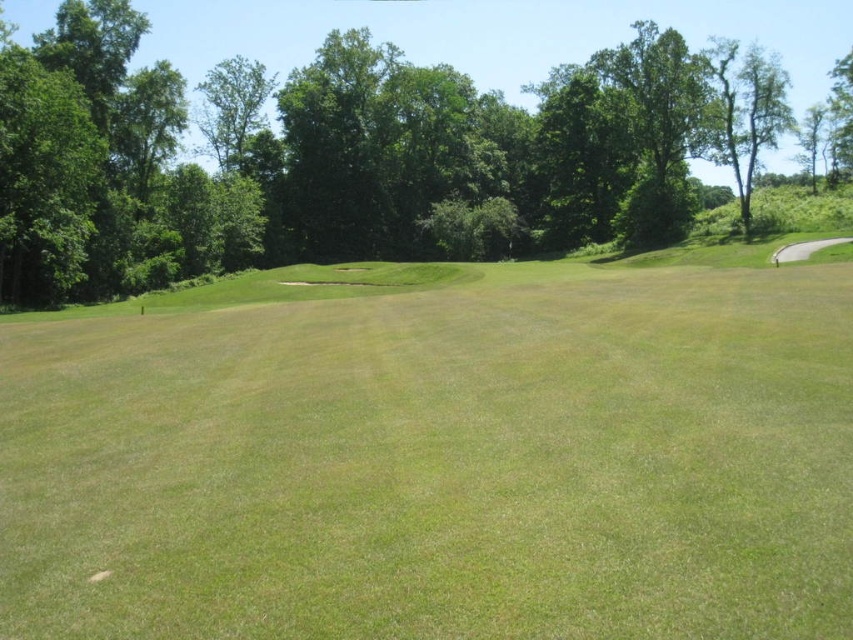
You are a golfer standing at the tee box and want to hit your ball to the green grassy field at center. Based on the coordinates provided, can you determine the direction you should aim your shot?

The green grassy field at center is located at coordinates point (440,464), so you should aim your shot towards the center of the fairway where the coordinates indicate the position of the green grassy field at center.

You are a golfer standing on the green grassy field at center. You want to hit the ball to the green leafy tree at center. Considering their widths, which object is wider?

The green leafy tree at center is wider than the green grassy field at center, so the green leafy tree at center is wider.

Looking at this image, you are standing on the edge of the green grassy field at center and want to throw a ball to a friend who is 5 meters away from you. Will the ball reach your friend if you throw it straight ahead?

The distance between you and the green grassy field at center is 4.56 meters. Since your friend is 5 meters away from you, the ball will not reach them as it would only travel 4.56 meters before hitting the field.